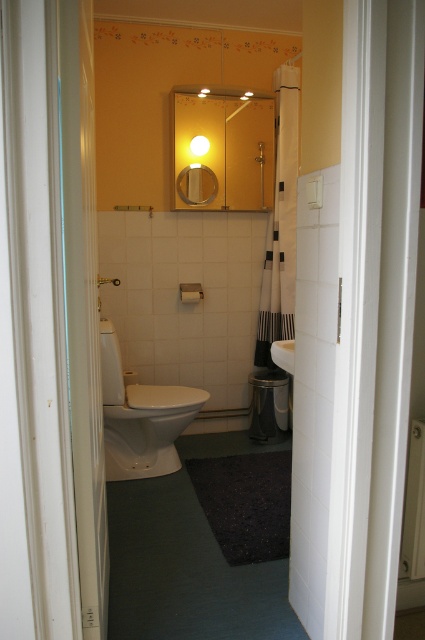
You are standing in the doorway of the bathroom. You need to reach the white glossy toilet at center and the matte white shower at center. Which one is closer to the doorway?

The white glossy toilet at center is closer to the doorway because it is to the right of the matte white shower at center, which is further away.

In the scene shown: You are a delivery person trying to place a 3.5 feet wide package in the bathroom. The package must be placed between the white glossy sink at center and the matte white shower at center. Can the package fit in that space?

The white glossy sink at center and matte white shower at center are 3.45 feet apart from each other. Since the package is 3.5 feet wide, it cannot fit between them as the space is slightly narrower than the package.